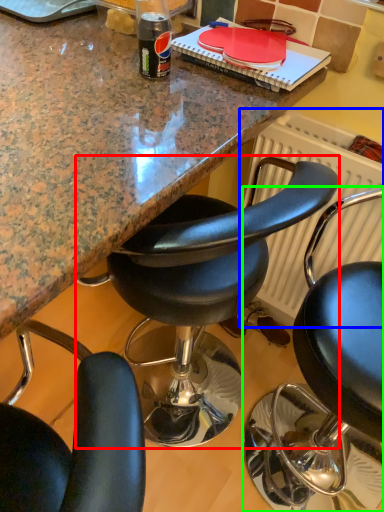
Question: Which object is the closest to the chair (highlighted by a red box)? Choose among these: radiator (highlighted by a blue box) or chair (highlighted by a green box).

Choices:
 (A) radiator
 (B) chair

Answer: (A)